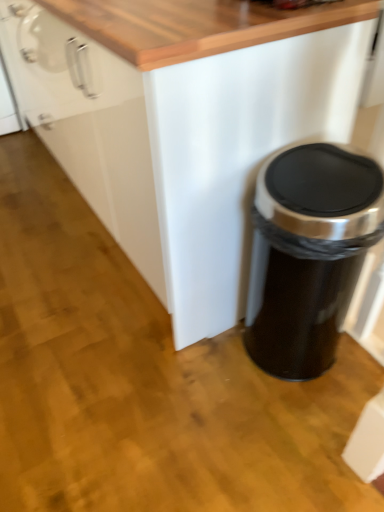
I want to click on vacant space situated on the left part of black matte trash can at lower right, so click(207, 371).